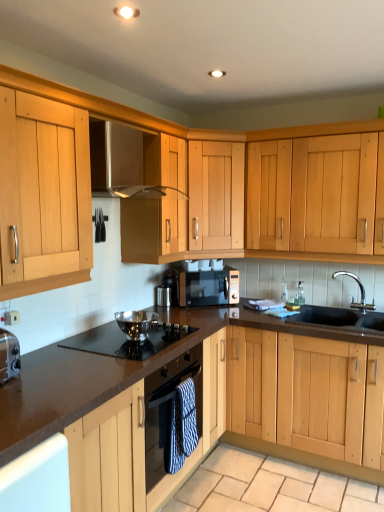
Question: Is light wood cabinet at center, which is counted as the 1th cabinetry, starting from the back, turned away from wooden cabinet at center, the first cabinetry ordered from the bottom?

Choices:
 (A) yes
 (B) no

Answer: (B)

Question: Is light wood cabinet at center, acting as the second cabinetry starting from the front, shorter than wooden cabinet at center, the first cabinetry ordered from the bottom?

Choices:
 (A) no
 (B) yes

Answer: (A)

Question: Is light wood cabinet at center, which is counted as the 1th cabinetry, starting from the back, at the left side of wooden cabinet at center, acting as the 2th cabinetry starting from the top?

Choices:
 (A) yes
 (B) no

Answer: (B)

Question: Is light wood cabinet at center, acting as the second cabinetry starting from the front, at the right side of wooden cabinet at center, which ranks as the 1th cabinetry in front-to-back order?

Choices:
 (A) no
 (B) yes

Answer: (B)

Question: From the image's perspective, is light wood cabinet at center, acting as the second cabinetry starting from the front, over wooden cabinet at center, the first cabinetry ordered from the bottom?

Choices:
 (A) no
 (B) yes

Answer: (B)

Question: Is light wood cabinet at center, marked as the second cabinetry in a bottom-to-top arrangement, bigger than wooden cabinet at center, which ranks as the 1th cabinetry in front-to-back order?

Choices:
 (A) no
 (B) yes

Answer: (A)

Question: Is beige stone granite at lower center closer to camera compared to polished stainless steel bowl at center?

Choices:
 (A) no
 (B) yes

Answer: (B)

Question: Is polished stainless steel bowl at center inside beige stone granite at lower center?

Choices:
 (A) no
 (B) yes

Answer: (A)

Question: Can you confirm if beige stone granite at lower center is taller than polished stainless steel bowl at center?

Choices:
 (A) no
 (B) yes

Answer: (A)

Question: From the image's perspective, is beige stone granite at lower center on polished stainless steel bowl at center?

Choices:
 (A) yes
 (B) no

Answer: (B)

Question: Considering the relative sizes of beige stone granite at lower center and polished stainless steel bowl at center in the image provided, is beige stone granite at lower center bigger than polished stainless steel bowl at center?

Choices:
 (A) yes
 (B) no

Answer: (A)

Question: Can you confirm if beige stone granite at lower center is smaller than polished stainless steel bowl at center?

Choices:
 (A) yes
 (B) no

Answer: (B)

Question: From a real-world perspective, does polished stainless steel bowl at center stand above matte black microwave at center?

Choices:
 (A) no
 (B) yes

Answer: (A)